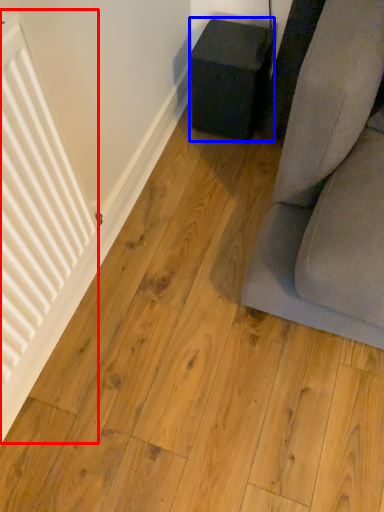
Question: Which object is closer to the camera taking this photo, radiator (highlighted by a red box) or furniture (highlighted by a blue box)?

Choices:
 (A) radiator
 (B) furniture

Answer: (A)